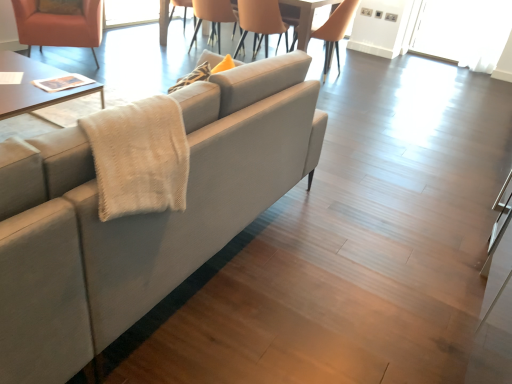
Question: From the image's perspective, is transparent glass door at upper right located beneath matte beige chair at upper center, which appears as the third chair when viewed from the left?

Choices:
 (A) no
 (B) yes

Answer: (A)

Question: Is transparent glass door at upper right aimed at matte beige chair at upper center, which appears as the third chair when viewed from the left?

Choices:
 (A) no
 (B) yes

Answer: (A)

Question: Can you confirm if transparent glass door at upper right is thinner than matte beige chair at upper center, placed as the second chair when sorted from right to left?

Choices:
 (A) no
 (B) yes

Answer: (B)

Question: Is transparent glass door at upper right next to matte beige chair at upper center, which appears as the third chair when viewed from the left?

Choices:
 (A) yes
 (B) no

Answer: (B)

Question: Is transparent glass door at upper right facing away from matte beige chair at upper center, which appears as the third chair when viewed from the left?

Choices:
 (A) yes
 (B) no

Answer: (B)

Question: Considering the relative sizes of transparent glass door at upper right and matte beige chair at upper center, which appears as the third chair when viewed from the left, in the image provided, is transparent glass door at upper right bigger than matte beige chair at upper center, which appears as the third chair when viewed from the left,?

Choices:
 (A) no
 (B) yes

Answer: (A)

Question: Is orange leather chair at upper center, which is counted as the third chair, starting from the right, taller than matte orange armchair at upper left, the 4th chair viewed from the right?

Choices:
 (A) yes
 (B) no

Answer: (A)

Question: From a real-world perspective, is orange leather chair at upper center, which is the 2th chair in left-to-right order, on matte orange armchair at upper left, the 4th chair viewed from the right?

Choices:
 (A) yes
 (B) no

Answer: (A)

Question: Is orange leather chair at upper center, which is counted as the third chair, starting from the right, outside of matte orange armchair at upper left, which is counted as the first chair, starting from the left?

Choices:
 (A) no
 (B) yes

Answer: (B)

Question: Is orange leather chair at upper center, which is the 2th chair in left-to-right order, turned away from matte orange armchair at upper left, the 4th chair viewed from the right?

Choices:
 (A) yes
 (B) no

Answer: (B)

Question: Considering the relative sizes of orange leather chair at upper center, which is counted as the third chair, starting from the right, and matte orange armchair at upper left, the 4th chair viewed from the right, in the image provided, is orange leather chair at upper center, which is counted as the third chair, starting from the right, wider than matte orange armchair at upper left, the 4th chair viewed from the right,?

Choices:
 (A) yes
 (B) no

Answer: (B)

Question: Can you confirm if orange leather chair at upper center, which is counted as the third chair, starting from the right, is positioned to the left of matte orange armchair at upper left, which is counted as the first chair, starting from the left?

Choices:
 (A) no
 (B) yes

Answer: (A)

Question: From the image's perspective, is light brown leather chair at upper center, positioned as the 1th chair in right-to-left order, on top of orange leather chair at upper center, which is the 2th chair in left-to-right order?

Choices:
 (A) no
 (B) yes

Answer: (A)